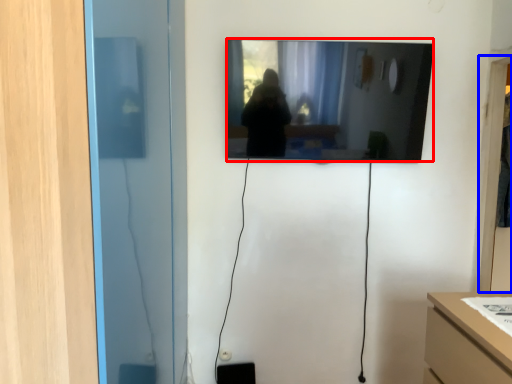
Question: Among these objects, which one is farthest to the camera, mirror (highlighted by a red box) or glass door (highlighted by a blue box)?

Choices:
 (A) mirror
 (B) glass door

Answer: (B)